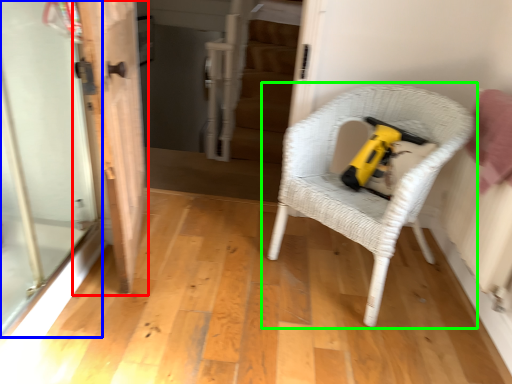
Question: Estimate the real-world distances between objects in this image. Which object is closer to door (highlighted by a red box), screen door (highlighted by a blue box) or chair (highlighted by a green box)?

Choices:
 (A) screen door
 (B) chair

Answer: (A)